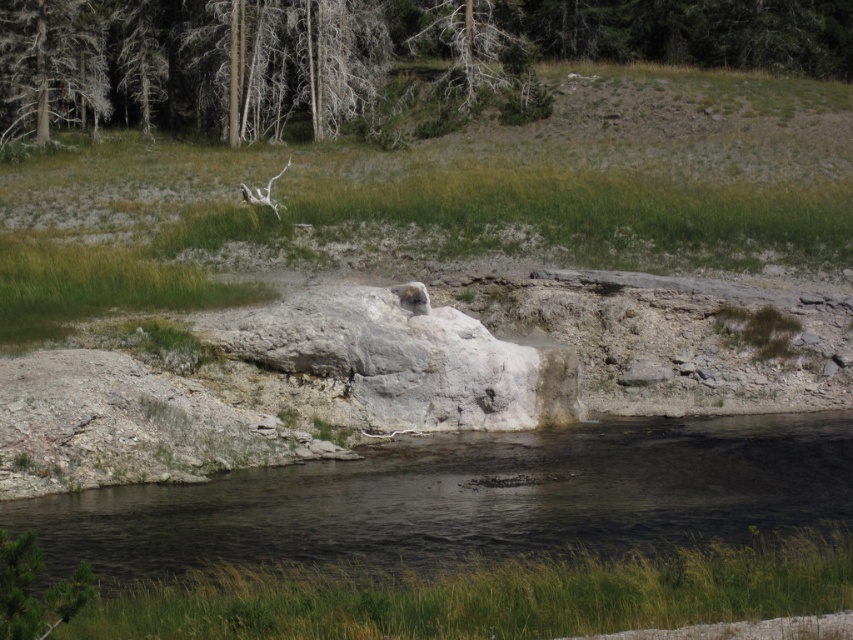
You are an environmental scientist assessing the scene. You need to determine which area is smaller in size between the black smooth water at lower center and the dead wood tree at upper center. Based on the description, which one is smaller?

The black smooth water at lower center occupies less space than the dead wood tree at upper center, so the black smooth water at lower center is smaller in size.

In the scene shown: You are standing at the edge of the water in the scene. Which object, the black smooth water at lower center or the dead wood tree at upper center, is nearer to you?

The black smooth water at lower center is closer to the viewer than the dead wood tree at upper center.